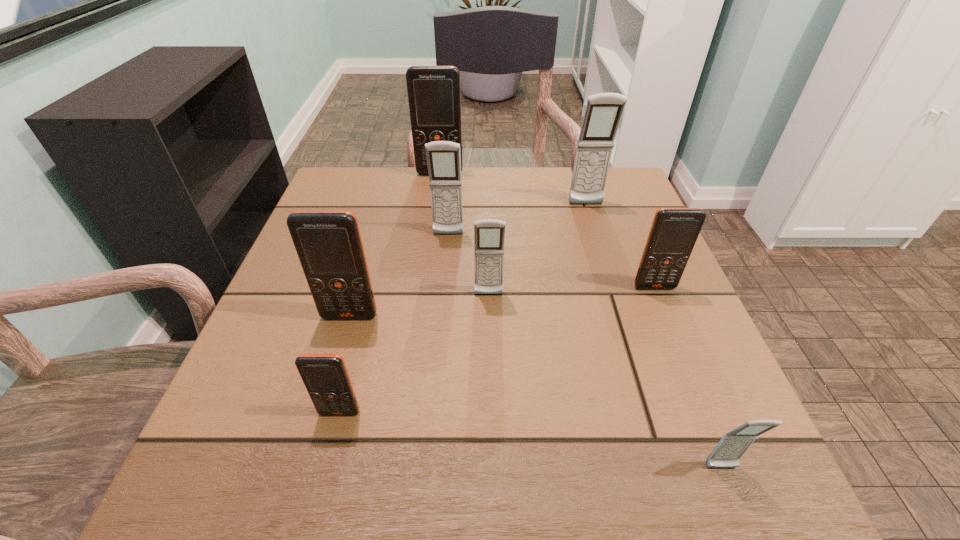
Locate an element on the screen. Image resolution: width=960 pixels, height=540 pixels. the second farthest orange cellular telephone is located at coordinates (674, 231).

I want to click on the third biggest orange cellular telephone, so click(x=674, y=231).

Locate an element on the screen. Image resolution: width=960 pixels, height=540 pixels. the seventh farthest object is located at coordinates (325, 376).

This screenshot has height=540, width=960. I want to click on the nearest orange cellular telephone, so click(325, 376).

The width and height of the screenshot is (960, 540). I want to click on the rightmost gray cellular telephone, so click(x=733, y=445).

Locate an element on the screen. The height and width of the screenshot is (540, 960). the smallest gray cellular telephone is located at coordinates (733, 445).

In order to click on free space located on the screen of the second orange cellular telephone from right to left in this screenshot , I will do `click(434, 217)`.

Locate an element on the screen. free point located 0.240m on the front-facing side of the seventh nearest object is located at coordinates (609, 279).

Locate an element on the screen. The height and width of the screenshot is (540, 960). vacant space located 0.300m on the front-facing side of the third farthest cellular telephone is located at coordinates (439, 350).

Find the location of a particular element. free space located 0.190m on the screen of the third farthest orange cellular telephone is located at coordinates (320, 420).